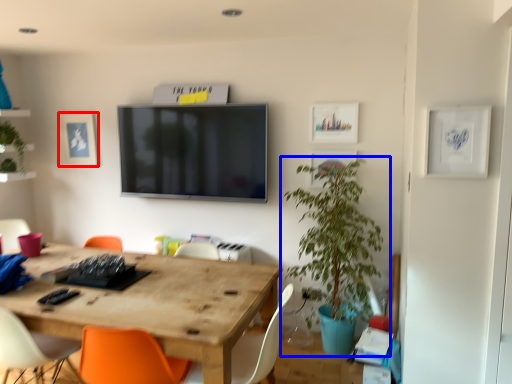
Question: Which point is closer to the camera, picture frame (highlighted by a red box) or houseplant (highlighted by a blue box)?

Choices:
 (A) picture frame
 (B) houseplant

Answer: (B)